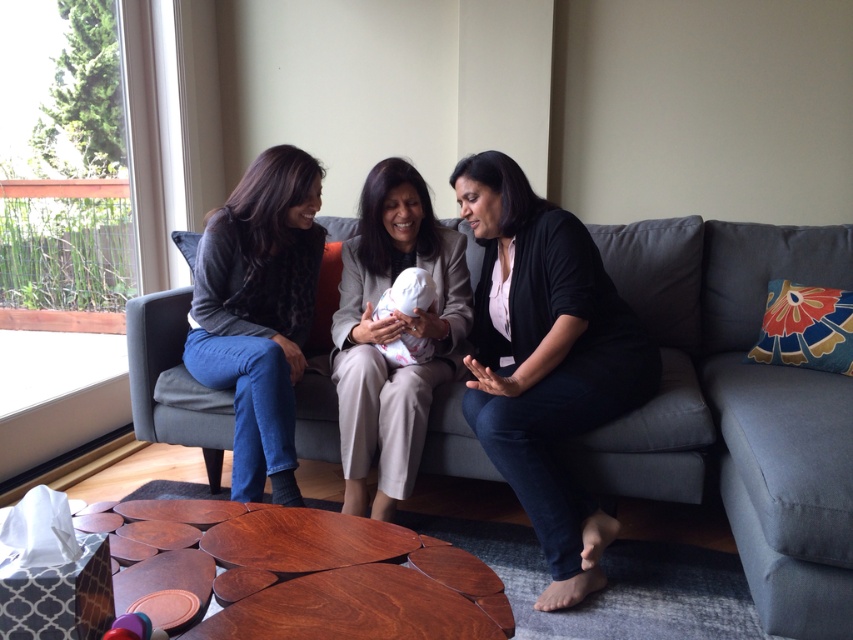
You are a photographer setting up a studio for a baby photoshoot. You have two baby dolls to position on a gray sectional sofa at center. The dolls are labeled as the light beige fabric baby at center and the white soft baby at center. Based on the scene description, which baby doll should you place on the left side of the sofa to ensure it fits comfortably without overcrowding the space?

The white soft baby at center should be placed on the left side of the sofa because it is smaller in width compared to the light beige fabric baby at center, allowing for more comfortable spacing.

You are a photographer setting up a tripod at position point 0.522, 0.462. You want to capture a closeup of the light beige fabric baby at center. Is the tripod positioned correctly to frame the baby without any obstructions from the other women?

The light beige fabric baby at center is located at point (393, 333), so the tripod is positioned directly at the baby, which may place it too close or in front of the baby, potentially causing obstructions from the other women or the sofa. Adjust the position slightly to ensure a clear view.

You are standing in the living room and want to hand a toy to the baby. The toy is currently on the floor near the matte black sweater at left. To reach the light beige fabric baby at center, should you move the toy to the right or left?

The matte black sweater at left is to the left of the light beige fabric baby at center, so you should move the toy to the right to reach the baby.